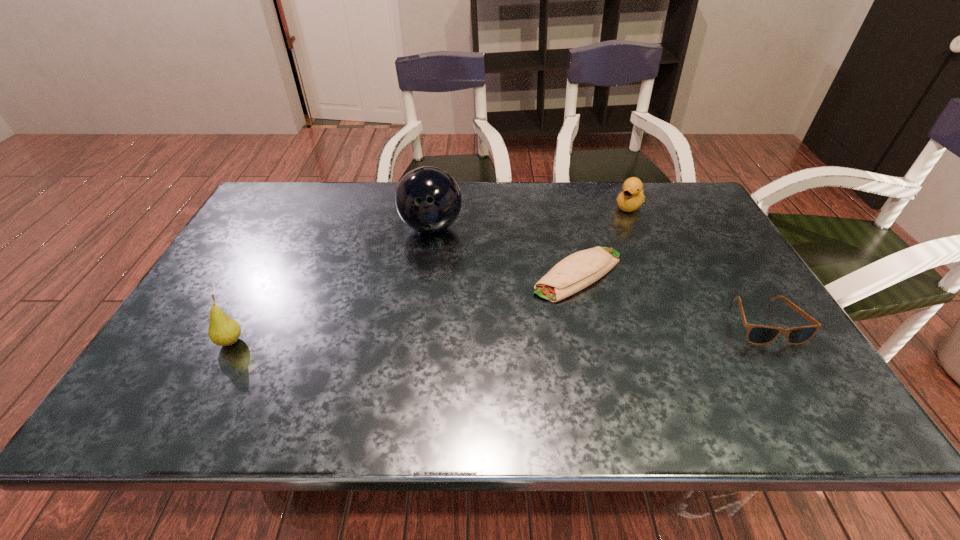
The height and width of the screenshot is (540, 960). Identify the location of vacant space that is in between the rightmost object and the duckling. (697, 264).

Identify the location of vacant area between the shortest object and the leftmost object. The height and width of the screenshot is (540, 960). (404, 308).

Locate an element on the screen. The height and width of the screenshot is (540, 960). vacant point located between the second tallest object and the third object from left to right is located at coordinates (404, 308).

Select which object is the fourth closest to the rightmost object. Please provide its 2D coordinates. Your answer should be formatted as a tuple, i.e. [(x, y)], where the tuple contains the x and y coordinates of a point satisfying the conditions above.

[(223, 331)]

At what (x,y) coordinates should I click in order to perform the action: click on the closest object to the leftmost object. Please return your answer as a coordinate pair (x, y). The height and width of the screenshot is (540, 960). Looking at the image, I should click on (428, 199).

At what (x,y) coordinates should I click in order to perform the action: click on blank area in the image that satisfies the following two spatial constraints: 1. on the back side of the second object from right to left; 2. on the right side of the pear. Please return your answer as a coordinate pair (x, y). The height and width of the screenshot is (540, 960). Looking at the image, I should click on (301, 206).

Find the location of a particular element. This screenshot has width=960, height=540. free space in the image that satisfies the following two spatial constraints: 1. on the back side of the third tallest object; 2. on the left side of the leftmost object is located at coordinates (301, 206).